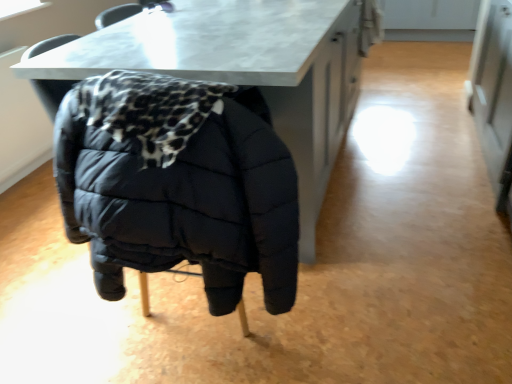
Identify the location of vacant space in front of matte black puffer jacket at center. (201, 359).